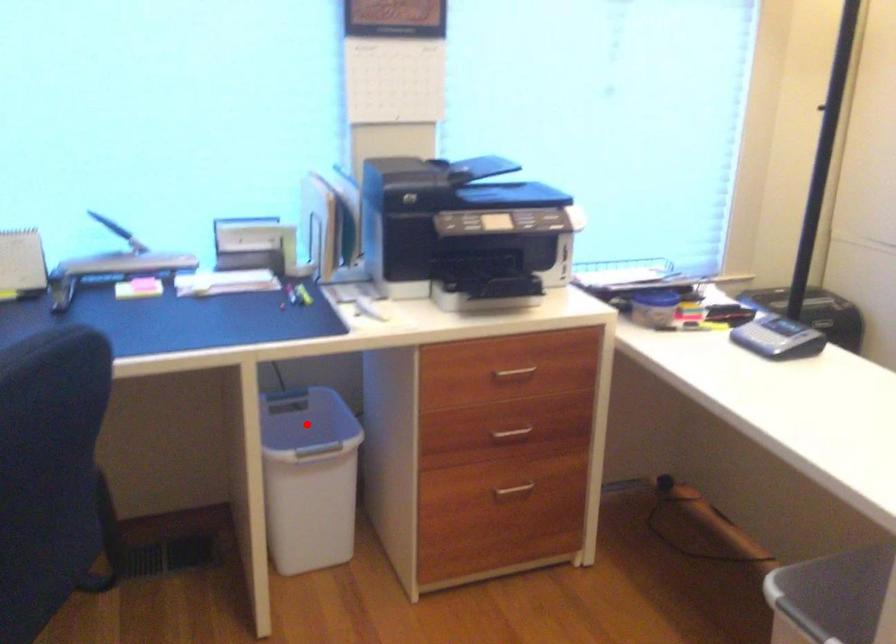
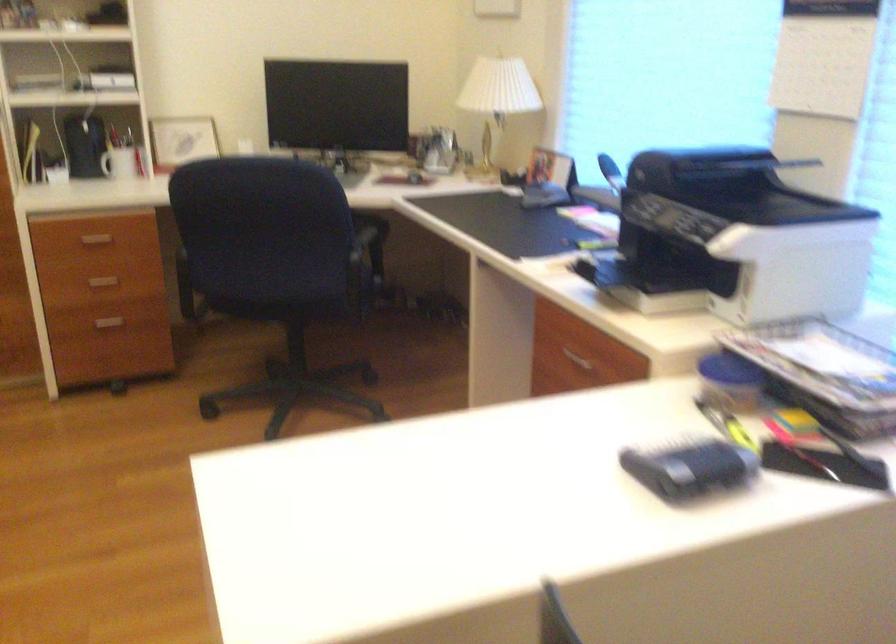
Question: I am providing you with two images of the same scene from different viewpoints. A red point is marked on the first image. Is the red point's position out of view in image 2?

Choices:
 (A) Yes
 (B) No

Answer: (A)